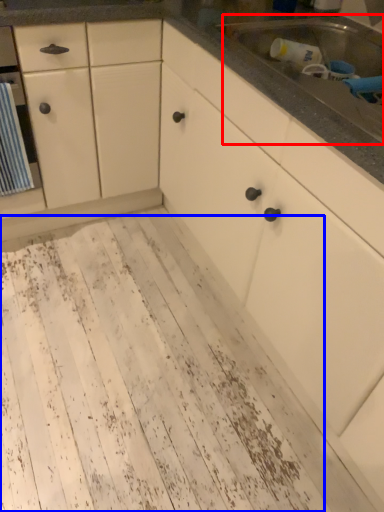
Question: Among these objects, which one is nearest to the camera, sink (highlighted by a red box) or mud (highlighted by a blue box)?

Choices:
 (A) sink
 (B) mud

Answer: (A)